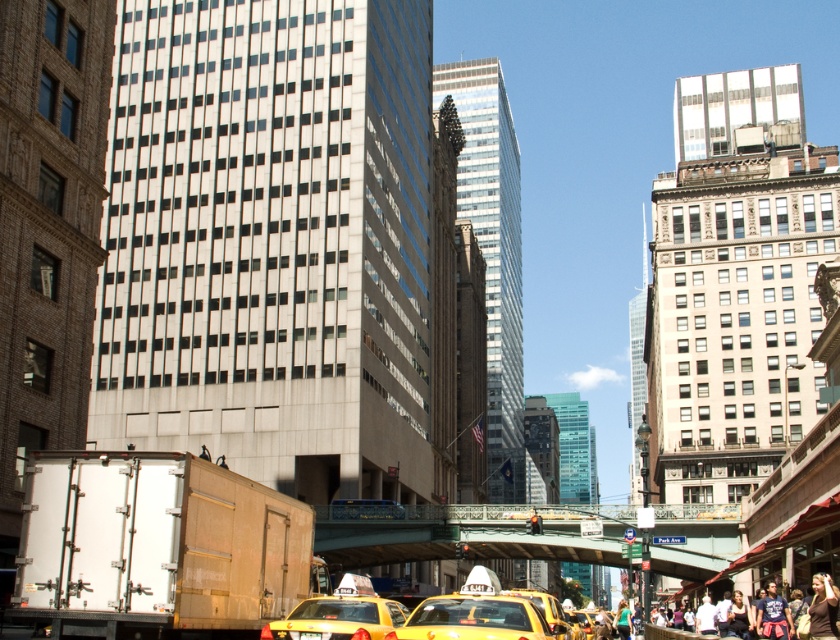
Does yellow matte taxi at center have a lesser height compared to yellow matte taxi at lower center?

No, yellow matte taxi at center is not shorter than yellow matte taxi at lower center.

Is yellow matte taxi at center above yellow matte taxi at lower center?

Incorrect, yellow matte taxi at center is not positioned above yellow matte taxi at lower center.

Which is behind, point (423, 627) or point (402, 625)?

Positioned behind is point (402, 625).

Identify the location of yellow matte taxi at center. The width and height of the screenshot is (840, 640). (476, 614).

Is green metal bridge at center bigger than denim jacket at lower right?

Yes, green metal bridge at center is bigger than denim jacket at lower right.

Who is taller, green metal bridge at center or denim jacket at lower right?

green metal bridge at center is taller.

Where is `green metal bridge at center`? green metal bridge at center is located at coordinates (466, 532).

Find the location of a particular element. green metal bridge at center is located at coordinates (466, 532).

Locate an element on the screen. This screenshot has height=640, width=840. yellow matte taxi at lower center is located at coordinates (340, 614).

Between point (371, 627) and point (835, 630), which one is positioned behind?

Point (835, 630)

Locate an element on the screen. The height and width of the screenshot is (640, 840). yellow matte taxi at lower center is located at coordinates (340, 614).